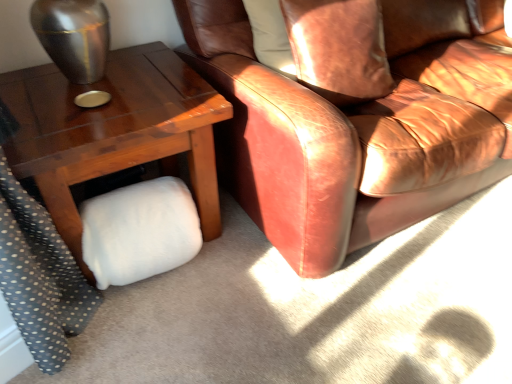
Question: From the image's perspective, is leather couch at center on top of leather pillow at upper right?

Choices:
 (A) no
 (B) yes

Answer: (B)

Question: Does leather couch at center have a lesser width compared to leather pillow at upper right?

Choices:
 (A) yes
 (B) no

Answer: (B)

Question: Does leather couch at center have a greater height compared to leather pillow at upper right?

Choices:
 (A) no
 (B) yes

Answer: (B)

Question: Is leather couch at center at the left side of leather pillow at upper right?

Choices:
 (A) no
 (B) yes

Answer: (A)

Question: Considering the relative sizes of leather couch at center and leather pillow at upper right in the image provided, is leather couch at center wider than leather pillow at upper right?

Choices:
 (A) yes
 (B) no

Answer: (A)

Question: From a real-world perspective, does leather couch at center sit lower than leather pillow at upper right?

Choices:
 (A) yes
 (B) no

Answer: (A)

Question: Is white fluffy pillow at lower left aimed at leather pillow at upper right?

Choices:
 (A) yes
 (B) no

Answer: (B)

Question: From the image's perspective, is white fluffy pillow at lower left above leather pillow at upper right?

Choices:
 (A) yes
 (B) no

Answer: (B)

Question: Is white fluffy pillow at lower left oriented away from leather pillow at upper right?

Choices:
 (A) yes
 (B) no

Answer: (B)

Question: Is white fluffy pillow at lower left not near leather pillow at upper right?

Choices:
 (A) yes
 (B) no

Answer: (B)

Question: From the image's perspective, is white fluffy pillow at lower left located beneath leather pillow at upper right?

Choices:
 (A) yes
 (B) no

Answer: (A)

Question: Is white fluffy pillow at lower left not inside leather pillow at upper right?

Choices:
 (A) no
 (B) yes

Answer: (B)

Question: Is leather couch at center thinner than wooden table at lower left?

Choices:
 (A) yes
 (B) no

Answer: (B)